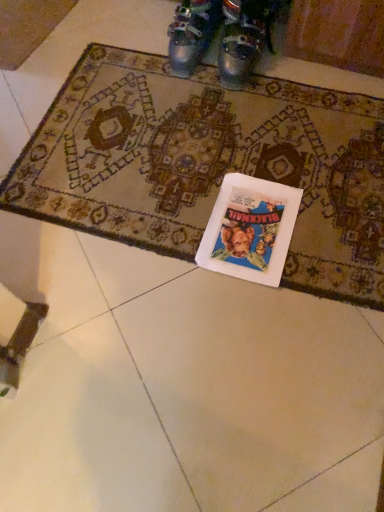
Describe the element at coordinates (209, 164) in the screenshot. Image resolution: width=384 pixels, height=512 pixels. I see `carpeted mat at center` at that location.

Image resolution: width=384 pixels, height=512 pixels. Describe the element at coordinates (192, 34) in the screenshot. I see `metallic silver boots at upper center, the second footwear when ordered from right to left` at that location.

Image resolution: width=384 pixels, height=512 pixels. I want to click on carpeted mat at center, so click(209, 164).

Considering the sizes of white paper book at center and metallic silver shoes at upper center, which ranks as the second footwear in left-to-right order, in the image, is white paper book at center bigger or smaller than metallic silver shoes at upper center, which ranks as the second footwear in left-to-right order,?

Considering their sizes, white paper book at center takes up less space than metallic silver shoes at upper center, which ranks as the second footwear in left-to-right order.

From a real-world perspective, is white paper book at center below metallic silver shoes at upper center, which ranks as the second footwear in left-to-right order?

Indeed, from a real-world perspective, white paper book at center is positioned beneath metallic silver shoes at upper center, which ranks as the second footwear in left-to-right order.

Considering the points (258, 202) and (226, 30), which point is in front, point (258, 202) or point (226, 30)?

The point (258, 202) is in front.

Do you think white paper book at center is within metallic silver shoes at upper center, which ranks as the second footwear in left-to-right order, or outside of it?

white paper book at center is located beyond the bounds of metallic silver shoes at upper center, which ranks as the second footwear in left-to-right order.

Is point (259, 34) less distant than point (83, 149)?

No, (259, 34) is further to viewer.

In terms of width, does metallic silver shoes at upper center, arranged as the 1th footwear when viewed from the right, look wider or thinner when compared to carpeted mat at center?

metallic silver shoes at upper center, arranged as the 1th footwear when viewed from the right, is thinner than carpeted mat at center.

From a real-world perspective, is metallic silver shoes at upper center, which ranks as the second footwear in left-to-right order, above or below carpeted mat at center?

metallic silver shoes at upper center, which ranks as the second footwear in left-to-right order, is situated higher than carpeted mat at center in the real world.

Between metallic silver shoes at upper center, which ranks as the second footwear in left-to-right order, and carpeted mat at center, which one has smaller size?

metallic silver shoes at upper center, which ranks as the second footwear in left-to-right order.

From a real-world perspective, relative to metallic silver boots at upper center, the second footwear when ordered from right to left, is metallic silver shoes at upper center, which ranks as the second footwear in left-to-right order, vertically above or below?

metallic silver shoes at upper center, which ranks as the second footwear in left-to-right order, is situated higher than metallic silver boots at upper center, the second footwear when ordered from right to left, in the real world.

Between metallic silver shoes at upper center, which ranks as the second footwear in left-to-right order, and metallic silver boots at upper center, which is counted as the first footwear, starting from the left, which one has smaller size?

metallic silver boots at upper center, which is counted as the first footwear, starting from the left.

Can you tell me how much metallic silver shoes at upper center, which ranks as the second footwear in left-to-right order, and metallic silver boots at upper center, the second footwear when ordered from right to left, differ in facing direction?

The angular difference between metallic silver shoes at upper center, which ranks as the second footwear in left-to-right order, and metallic silver boots at upper center, the second footwear when ordered from right to left, is 0.000706 degrees.

From the image's perspective, which one is positioned higher, metallic silver shoes at upper center, which ranks as the second footwear in left-to-right order, or metallic silver boots at upper center, the second footwear when ordered from right to left?

metallic silver boots at upper center, the second footwear when ordered from right to left.

Is metallic silver boots at upper center, the second footwear when ordered from right to left, positioned beyond the bounds of carpeted mat at center?

Indeed, metallic silver boots at upper center, the second footwear when ordered from right to left, is completely outside carpeted mat at center.

Is metallic silver boots at upper center, which is counted as the first footwear, starting from the left, facing away from carpeted mat at center?

No, metallic silver boots at upper center, which is counted as the first footwear, starting from the left, is not facing away from carpeted mat at center.

In terms of height, does metallic silver boots at upper center, which is counted as the first footwear, starting from the left, look taller or shorter compared to carpeted mat at center?

metallic silver boots at upper center, which is counted as the first footwear, starting from the left, is taller than carpeted mat at center.

Would you consider metallic silver boots at upper center, the second footwear when ordered from right to left, to be distant from carpeted mat at center?

metallic silver boots at upper center, the second footwear when ordered from right to left, is actually quite close to carpeted mat at center.

The height and width of the screenshot is (512, 384). Identify the location of the 2nd footwear above the white paper book at center (from the image's perspective). (192, 34).

In terms of size, does white paper book at center appear bigger or smaller than metallic silver boots at upper center, which is counted as the first footwear, starting from the left?

Considering their sizes, white paper book at center takes up less space than metallic silver boots at upper center, which is counted as the first footwear, starting from the left.

Between white paper book at center and metallic silver boots at upper center, which is counted as the first footwear, starting from the left, which one appears on the left side from the viewer's perspective?

Positioned to the left is metallic silver boots at upper center, which is counted as the first footwear, starting from the left.

Considering the relative sizes of metallic silver boots at upper center, the second footwear when ordered from right to left, and metallic silver shoes at upper center, arranged as the 1th footwear when viewed from the right, in the image provided, is metallic silver boots at upper center, the second footwear when ordered from right to left, bigger than metallic silver shoes at upper center, arranged as the 1th footwear when viewed from the right,?

Incorrect, metallic silver boots at upper center, the second footwear when ordered from right to left, is not larger than metallic silver shoes at upper center, arranged as the 1th footwear when viewed from the right.

Considering the relative positions of metallic silver boots at upper center, which is counted as the first footwear, starting from the left, and metallic silver shoes at upper center, which ranks as the second footwear in left-to-right order, in the image provided, is metallic silver boots at upper center, which is counted as the first footwear, starting from the left, to the left or to the right of metallic silver shoes at upper center, which ranks as the second footwear in left-to-right order,?

metallic silver boots at upper center, which is counted as the first footwear, starting from the left, is positioned on metallic silver shoes at upper center, which ranks as the second footwear in left-to-right order,'s left side.

Does metallic silver boots at upper center, the second footwear when ordered from right to left, have a greater height compared to metallic silver shoes at upper center, which ranks as the second footwear in left-to-right order?

No.

Is metallic silver boots at upper center, which is counted as the first footwear, starting from the left, inside the boundaries of metallic silver shoes at upper center, which ranks as the second footwear in left-to-right order, or outside?

metallic silver boots at upper center, which is counted as the first footwear, starting from the left, is spatially situated outside metallic silver shoes at upper center, which ranks as the second footwear in left-to-right order.

Is metallic silver boots at upper center, which is counted as the first footwear, starting from the left, next to white paper book at center?

No, metallic silver boots at upper center, which is counted as the first footwear, starting from the left, is not touching white paper book at center.

Considering the relative positions of metallic silver boots at upper center, which is counted as the first footwear, starting from the left, and white paper book at center in the image provided, is metallic silver boots at upper center, which is counted as the first footwear, starting from the left, behind white paper book at center?

Yes, it is.

Based on the photo, is metallic silver boots at upper center, which is counted as the first footwear, starting from the left, at the left side of white paper book at center?

Yes.

This screenshot has height=512, width=384. Identify the location of the 2nd footwear located above the white paper book at center (from a real-world perspective). (244, 38).

Starting from the carpeted mat at center, which footwear is the 1st one behind? Please provide its 2D coordinates.

[(244, 38)]

Estimate the real-world distances between objects in this image. Which object is further from white paper book at center, metallic silver shoes at upper center, arranged as the 1th footwear when viewed from the right, or carpeted mat at center?

metallic silver shoes at upper center, arranged as the 1th footwear when viewed from the right, is further to white paper book at center.

Based on their spatial positions, is metallic silver shoes at upper center, arranged as the 1th footwear when viewed from the right, or white paper book at center further from carpeted mat at center?

Among the two, metallic silver shoes at upper center, arranged as the 1th footwear when viewed from the right, is located further to carpeted mat at center.

Based on the photo, estimate the real-world distances between objects in this image. Which object is further from metallic silver boots at upper center, the second footwear when ordered from right to left, white paper book at center or metallic silver shoes at upper center, which ranks as the second footwear in left-to-right order?

white paper book at center lies further to metallic silver boots at upper center, the second footwear when ordered from right to left, than the other object.

From the image, which object appears to be farther from metallic silver boots at upper center, which is counted as the first footwear, starting from the left, carpeted mat at center or metallic silver shoes at upper center, arranged as the 1th footwear when viewed from the right?

The object further to metallic silver boots at upper center, which is counted as the first footwear, starting from the left, is carpeted mat at center.

Which object lies nearer to the anchor point metallic silver boots at upper center, the second footwear when ordered from right to left, carpeted mat at center or white paper book at center?

carpeted mat at center.

From the picture: Looking at the image, which one is located further to carpeted mat at center, metallic silver boots at upper center, which is counted as the first footwear, starting from the left, or white paper book at center?

Among the two, metallic silver boots at upper center, which is counted as the first footwear, starting from the left, is located further to carpeted mat at center.

Estimate the real-world distances between objects in this image. Which object is closer to metallic silver boots at upper center, the second footwear when ordered from right to left, metallic silver shoes at upper center, arranged as the 1th footwear when viewed from the right, or white paper book at center?

metallic silver shoes at upper center, arranged as the 1th footwear when viewed from the right, lies closer to metallic silver boots at upper center, the second footwear when ordered from right to left, than the other object.

Estimate the real-world distances between objects in this image. Which object is further from carpeted mat at center, metallic silver shoes at upper center, which ranks as the second footwear in left-to-right order, or metallic silver boots at upper center, which is counted as the first footwear, starting from the left?

metallic silver boots at upper center, which is counted as the first footwear, starting from the left, is further to carpeted mat at center.

Identify the location of mat between metallic silver boots at upper center, the second footwear when ordered from right to left, and white paper book at center from top to bottom. pos(209,164).

Find the location of a particular element. This screenshot has width=384, height=512. mat that lies between metallic silver shoes at upper center, which ranks as the second footwear in left-to-right order, and white paper book at center from top to bottom is located at coordinates (209, 164).

Identify the location of footwear between metallic silver boots at upper center, which is counted as the first footwear, starting from the left, and white paper book at center, in the vertical direction. (244, 38).

I want to click on footwear that lies between metallic silver boots at upper center, the second footwear when ordered from right to left, and carpeted mat at center from top to bottom, so click(244, 38).